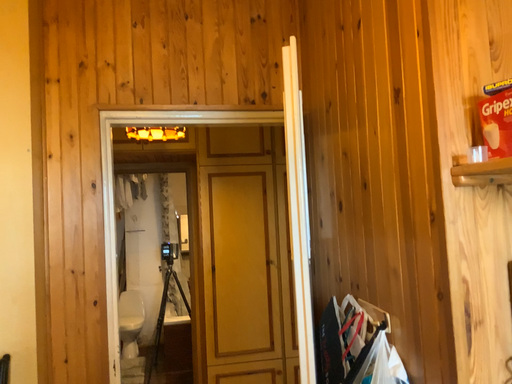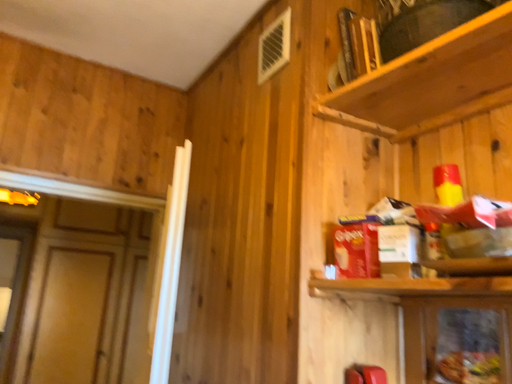
Question: Which way did the camera rotate in the video?

Choices:
 (A) rotated right
 (B) rotated left

Answer: (A)